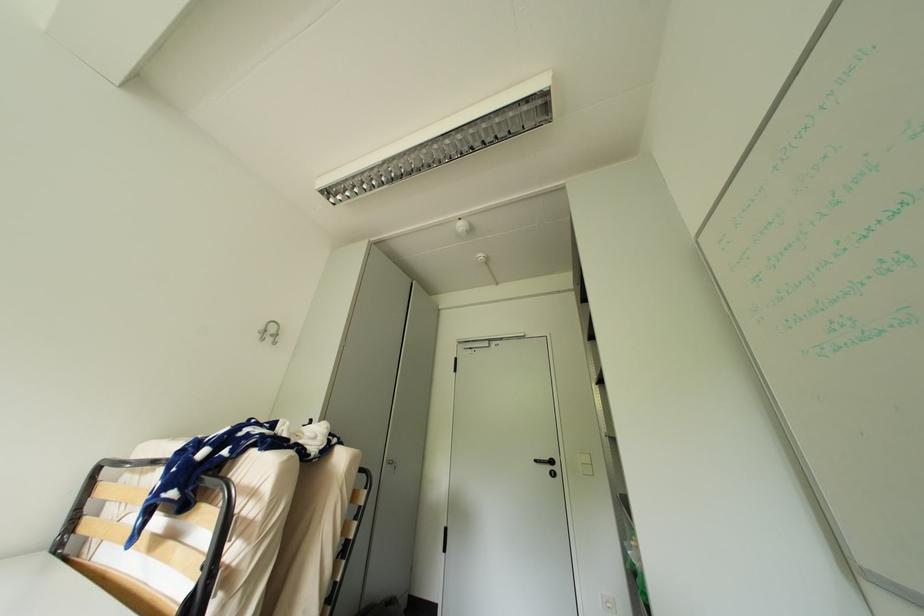
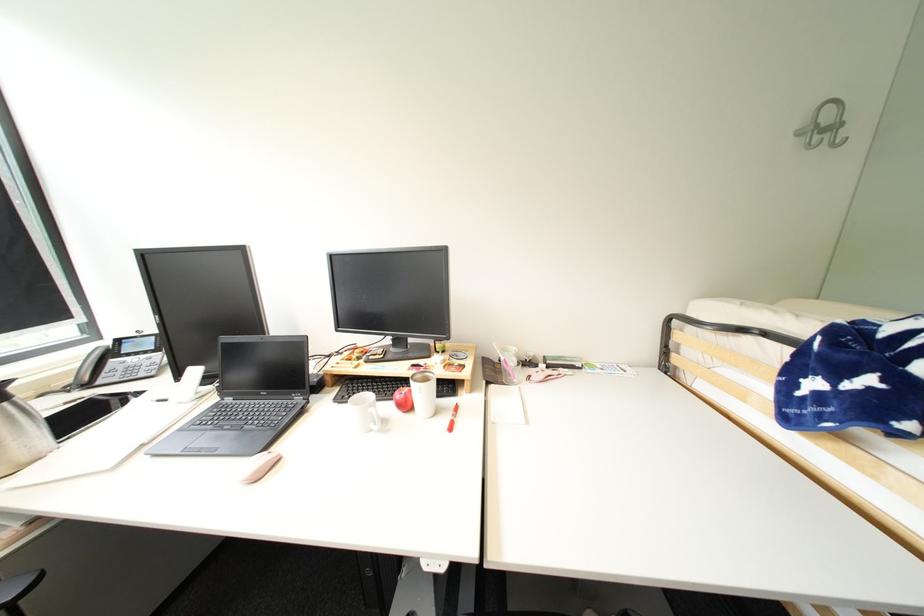
Where in the second image is the point corresponding to the point at 283,336 from the first image?

(841, 128)